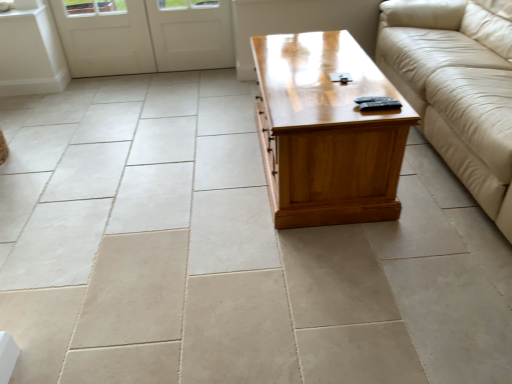
Question: From the image's perspective, relative to light brown wood coffee table at center, is white matte door at upper left above or below?

Choices:
 (A) below
 (B) above

Answer: (B)

Question: In the image, is white matte door at upper left on the left side or the right side of light brown wood coffee table at center?

Choices:
 (A) left
 (B) right

Answer: (A)

Question: Which object is positioned farthest from the light brown wood coffee table at center?

Choices:
 (A) beige leather couch at right
 (B) white matte door at upper left

Answer: (B)

Question: Which object is the farthest from the beige leather couch at right?

Choices:
 (A) light brown wood coffee table at center
 (B) white matte door at upper left

Answer: (B)